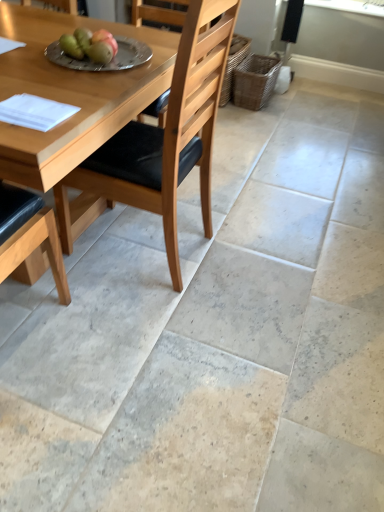
I want to click on vacant region to the left of green matte pears at upper center, the first fruit in the right-to-left sequence, so tap(38, 59).